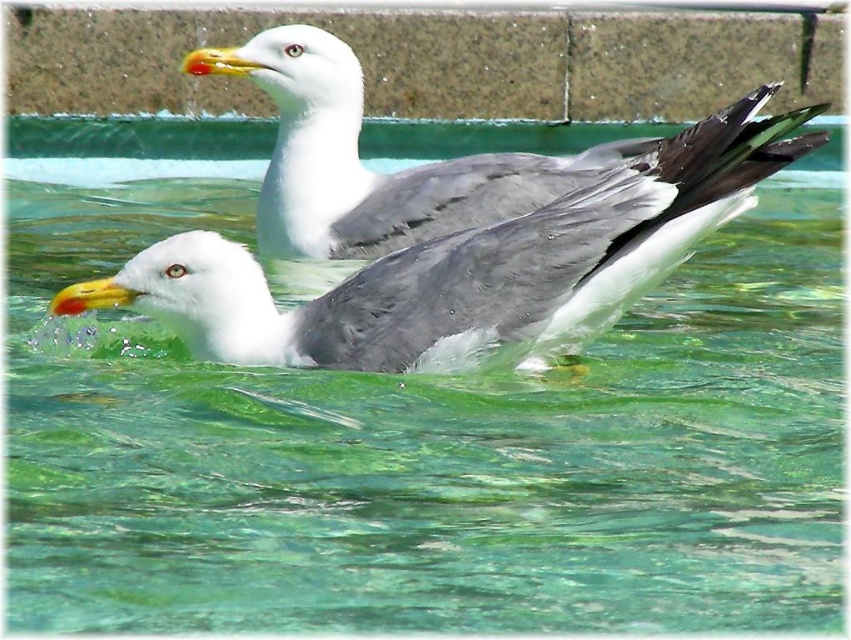
Question: Which point is farther to the camera?

Choices:
 (A) (627, 211)
 (B) (190, 58)

Answer: (B)

Question: Which point is closer to the camera?

Choices:
 (A) (281, 225)
 (B) (386, 371)

Answer: (B)

Question: Is gray matte seagull at center to the right of white matte seagull at upper center from the viewer's perspective?

Choices:
 (A) no
 (B) yes

Answer: (B)

Question: Does gray matte seagull at center appear on the left side of white matte seagull at upper center?

Choices:
 (A) no
 (B) yes

Answer: (A)

Question: Is gray matte seagull at center to the left of white matte seagull at upper center from the viewer's perspective?

Choices:
 (A) yes
 (B) no

Answer: (B)